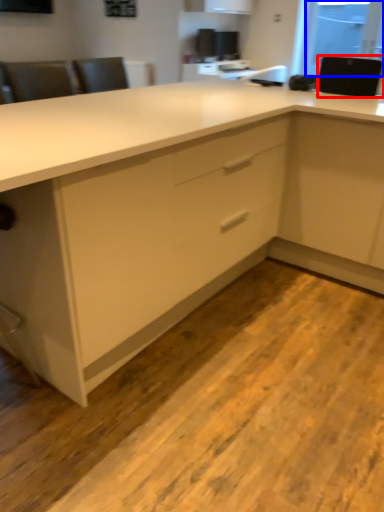
Question: Which object is closer to the camera taking this photo, appliance (highlighted by a red box) or window screen (highlighted by a blue box)?

Choices:
 (A) appliance
 (B) window screen

Answer: (A)